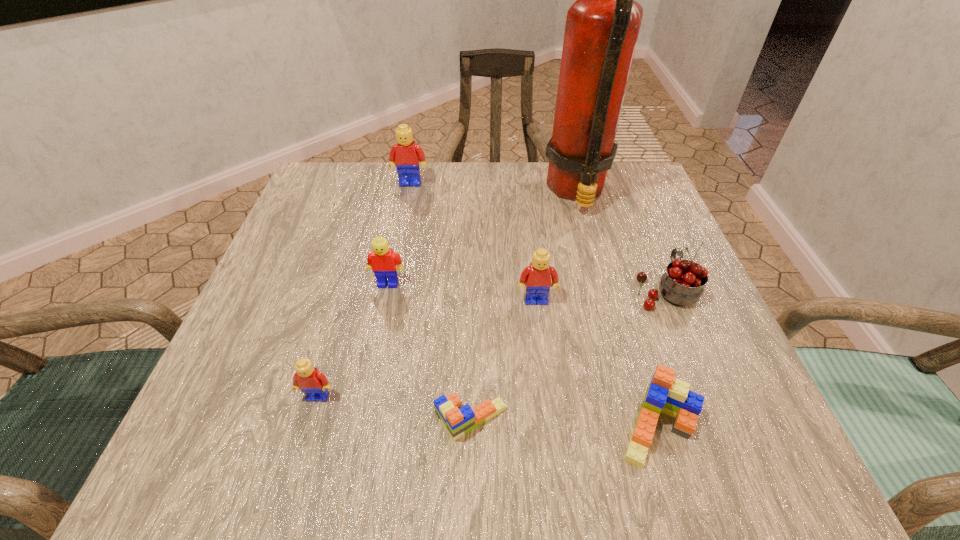
The height and width of the screenshot is (540, 960). I want to click on cherry at the right edge, so click(682, 284).

Where is `Lego located at the right edge`? Lego located at the right edge is located at coordinates (665, 394).

Identify the location of object that is at the far right corner. (602, 26).

Locate an element on the screen. The width and height of the screenshot is (960, 540). object located in the near right corner section of the desktop is located at coordinates (665, 394).

Where is `free space at the far edge of the desktop`? This screenshot has width=960, height=540. free space at the far edge of the desktop is located at coordinates (468, 163).

You are a GUI agent. You are given a task and a screenshot of the screen. Output one action in this format:
    pyautogui.click(x=<x>, y=<y>)
    Task: Click on the free space at the near edge of the desktop
    This screenshot has height=540, width=960.
    Given the screenshot: What is the action you would take?
    pyautogui.click(x=653, y=448)

This screenshot has height=540, width=960. What are the coordinates of `free region at the right edge of the desktop` in the screenshot? It's located at (698, 332).

The width and height of the screenshot is (960, 540). Identify the location of free point at the far left corner. (353, 168).

In the image, there is a desktop. Find the location of `vacant region at the near left corner`. vacant region at the near left corner is located at coordinates (252, 423).

The image size is (960, 540). Identify the location of vacant space at the far right corner of the desktop. (606, 194).